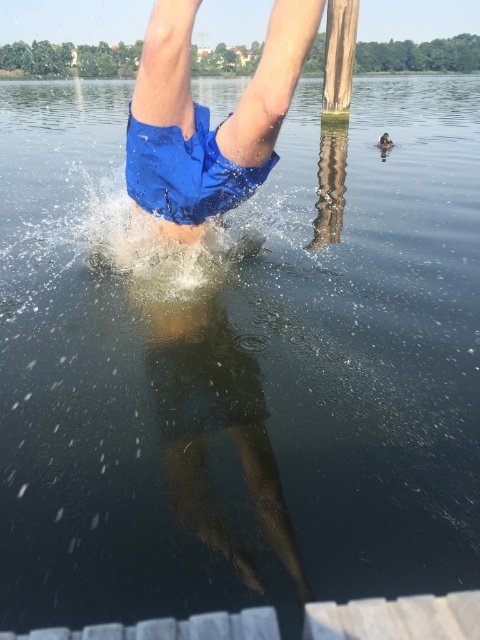
Question: Among these points, which one is farthest from the camera?

Choices:
 (A) (345, 60)
 (B) (178, 189)

Answer: (A)

Question: Does blue fabric shorts at center appear over green wood pole at upper center?

Choices:
 (A) no
 (B) yes

Answer: (A)

Question: Can you confirm if blue fabric shorts at center is positioned below green wood pole at upper center?

Choices:
 (A) yes
 (B) no

Answer: (A)

Question: Is blue fabric shorts at center wider than green wood pole at upper center?

Choices:
 (A) no
 (B) yes

Answer: (B)